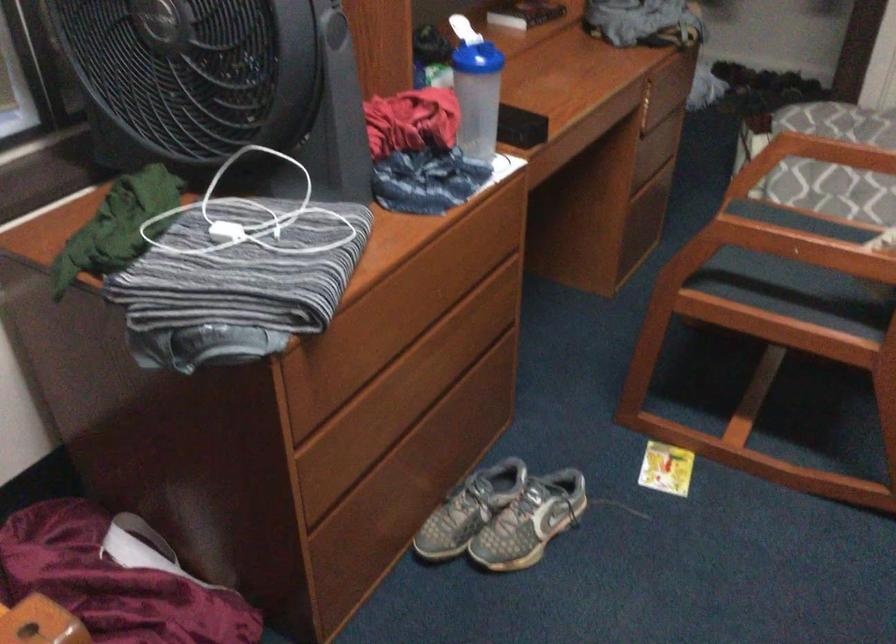
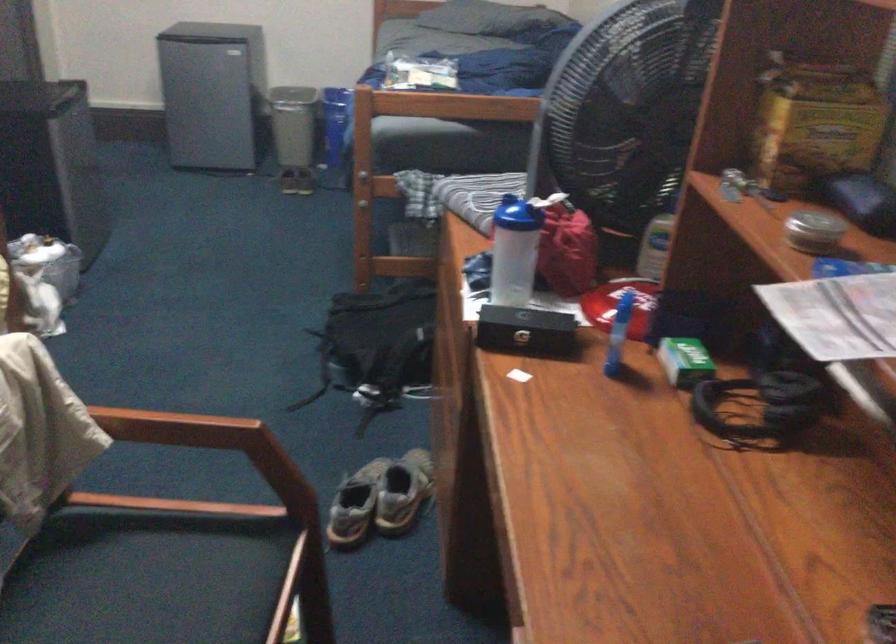
Find the pixel in the second image that matches pixel 545 520 in the first image.

(355, 505)